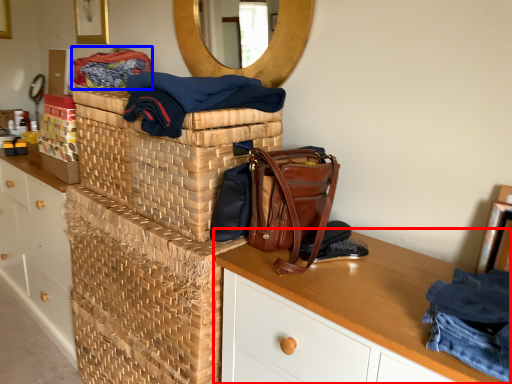
Question: Which object is closer to the camera taking this photo, desk (highlighted by a red box) or material (highlighted by a blue box)?

Choices:
 (A) desk
 (B) material

Answer: (A)